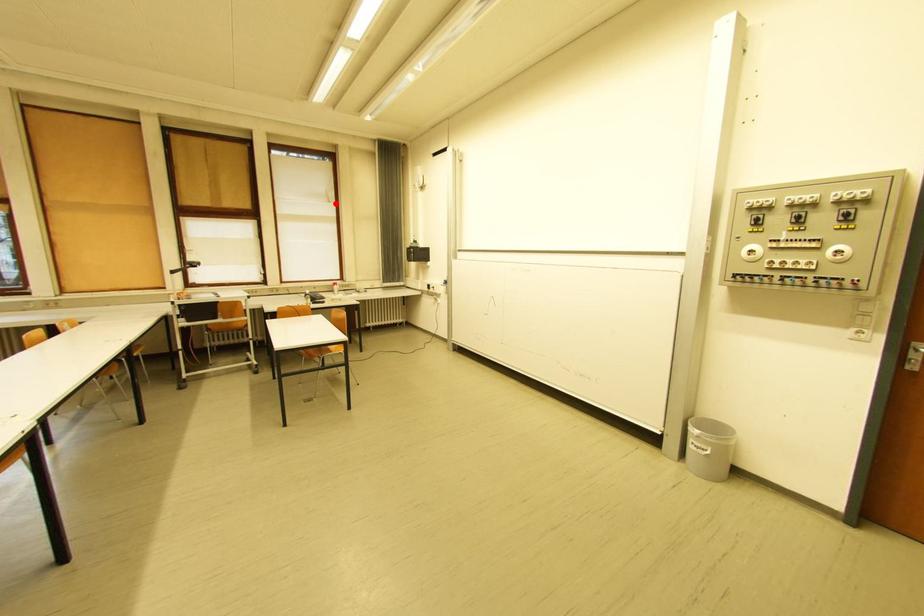
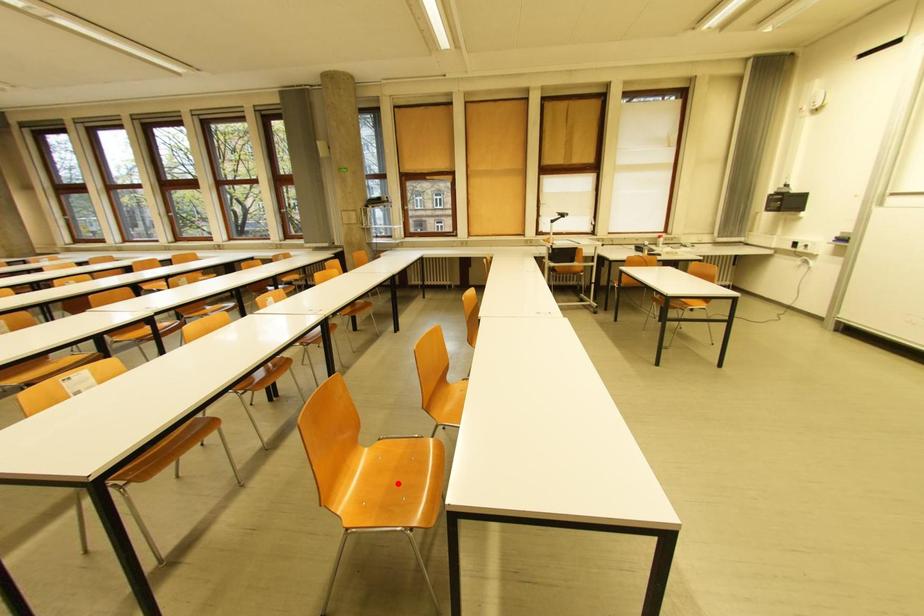
I am providing you with two images of the same scene from different viewpoints. A red point is marked on the first image and another point is marked on the second image. Is the marked point in image1 the same physical position as the marked point in image2?

No